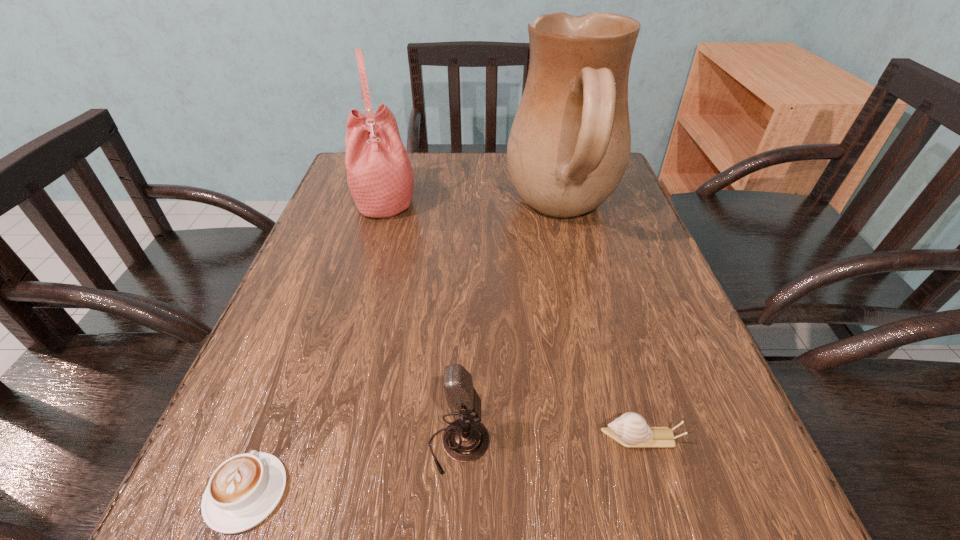
You are a GUI agent. You are given a task and a screenshot of the screen. Output one action in this format:
    pyautogui.click(x=<x>, y=<y>)
    Task: Click on the handbag at the left edge
    Image resolution: width=960 pixels, height=540 pixels.
    Given the screenshot: What is the action you would take?
    pyautogui.click(x=380, y=177)

Identify the location of cappuccino positioned at the left edge. This screenshot has height=540, width=960. (244, 490).

Locate an element on the screen. The image size is (960, 540). cream pitcher present at the right edge is located at coordinates (569, 146).

Where is `escargot that is positioned at the right edge`? Image resolution: width=960 pixels, height=540 pixels. escargot that is positioned at the right edge is located at coordinates (630, 429).

Find the location of a particular element. The height and width of the screenshot is (540, 960). object present at the far left corner is located at coordinates (380, 177).

At what (x,y) coordinates should I click in order to perform the action: click on object present at the near left corner. Please return your answer as a coordinate pair (x, y). This screenshot has height=540, width=960. Looking at the image, I should click on (244, 490).

You are a GUI agent. You are given a task and a screenshot of the screen. Output one action in this format:
    pyautogui.click(x=<x>, y=<y>)
    Task: Click on the object at the far right corner
    This screenshot has width=960, height=540.
    Given the screenshot: What is the action you would take?
    [569, 146]

Identify the location of free space at the far edge of the desktop. The image size is (960, 540). (499, 164).

Image resolution: width=960 pixels, height=540 pixels. In the image, there is a desktop. In order to click on blank space at the near edge in this screenshot , I will do `click(351, 499)`.

Identify the location of free point at the left edge. (295, 408).